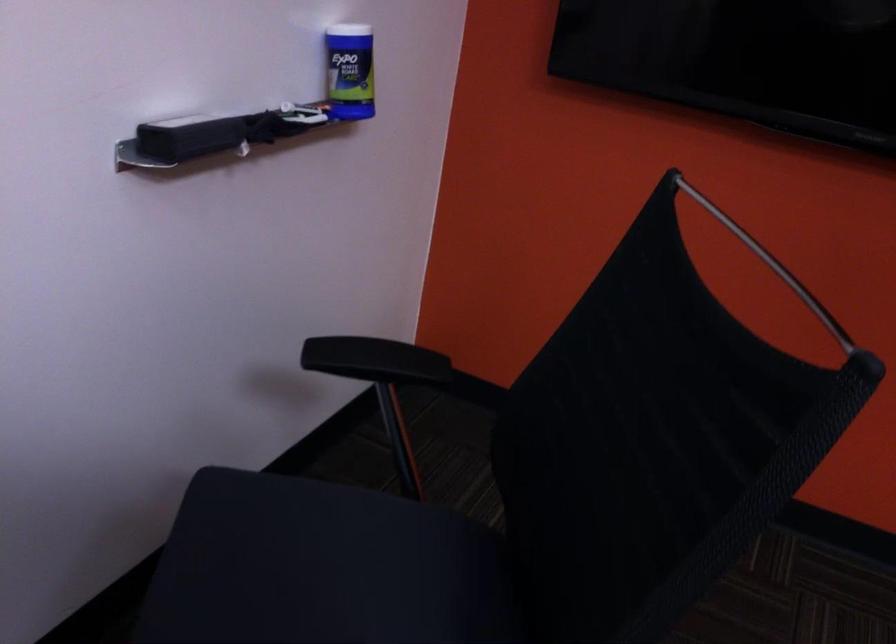
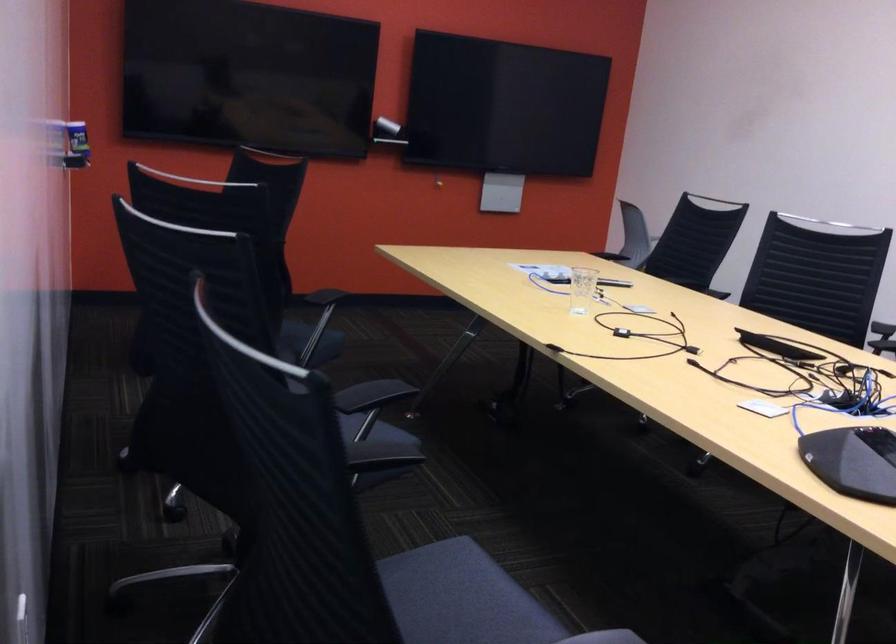
Locate, in the second image, the point that corresponds to point 297,122 in the first image.

(76, 145)